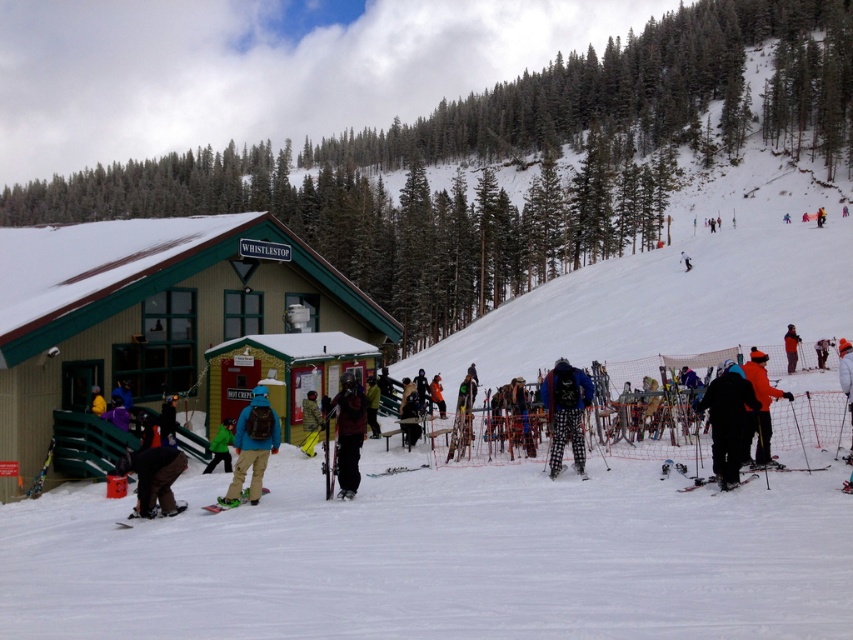
Question: Which object is positioned closest to the white snowboarder at center?

Choices:
 (A) orange ski jacket at center
 (B) black matte jacket at center
 (C) plaid pants at center

Answer: (A)

Question: Which point is closer to the camera?

Choices:
 (A) checkered fabric ski at center
 (B) black matte jacket at center
 (C) orange ski jacket at center

Answer: (B)

Question: Which of these objects is positioned farthest from the plaid pants at center?

Choices:
 (A) matte black ski at lower left
 (B) matte black skis at lower right
 (C) orange softshell jacket at center-right
 (D) white matte ski at center

Answer: (C)

Question: Does green wooden hut at center come behind matte black skis at lower right?

Choices:
 (A) yes
 (B) no

Answer: (A)

Question: Is dark brown snowboard at lower left to the right of white snow pants at center from the viewer's perspective?

Choices:
 (A) yes
 (B) no

Answer: (B)

Question: Is black matte jacket at center below white snow pants at center?

Choices:
 (A) yes
 (B) no

Answer: (A)